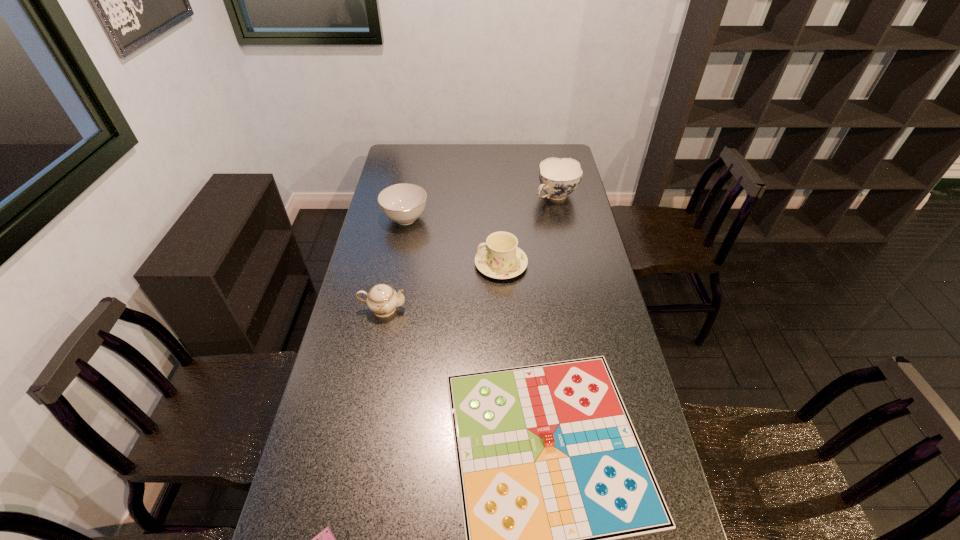
At what (x,y) coordinates should I click in order to perform the action: click on the rightmost chinaware. Please return your answer as a coordinate pair (x, y). The image size is (960, 540). Looking at the image, I should click on (559, 177).

Find the location of a particular element. The width and height of the screenshot is (960, 540). the tallest chinaware is located at coordinates (559, 177).

You are a GUI agent. You are given a task and a screenshot of the screen. Output one action in this format:
    pyautogui.click(x=<x>, y=<y>)
    Task: Click on the third farthest object
    
    Given the screenshot: What is the action you would take?
    pyautogui.click(x=500, y=258)

At what (x,y) coordinates should I click in order to perform the action: click on the second chinaware from right to left. Please return your answer as a coordinate pair (x, y). This screenshot has height=540, width=960. Looking at the image, I should click on (500, 258).

Locate an element on the screen. the fourth farthest object is located at coordinates (382, 299).

Locate an element on the screen. The width and height of the screenshot is (960, 540). vacant space located on the left of the tallest chinaware is located at coordinates (482, 197).

The image size is (960, 540). What are the coordinates of `blank space located on the handle side of the second nearest chinaware` in the screenshot? It's located at (386, 264).

What are the coordinates of `free space located 0.200m on the handle side of the second nearest chinaware` in the screenshot? It's located at (422, 264).

You are a GUI agent. You are given a task and a screenshot of the screen. Output one action in this format:
    pyautogui.click(x=<x>, y=<y>)
    Task: Click on the free location located 0.200m on the handle side of the second nearest chinaware
    The height and width of the screenshot is (540, 960).
    Given the screenshot: What is the action you would take?
    pyautogui.click(x=422, y=264)

The width and height of the screenshot is (960, 540). Identify the location of vacant point located 0.060m at the spout of the fourth farthest object. (424, 309).